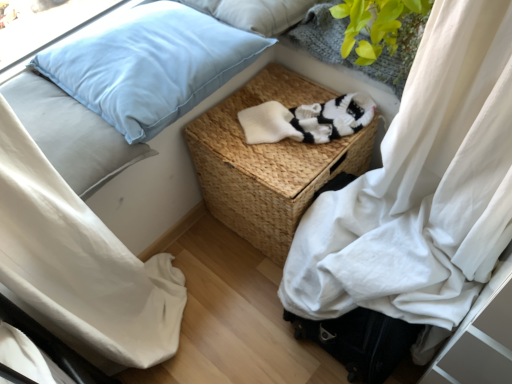
What are the coordinates of `free space on the front side of woven brown basket at center` in the screenshot? It's located at (241, 321).